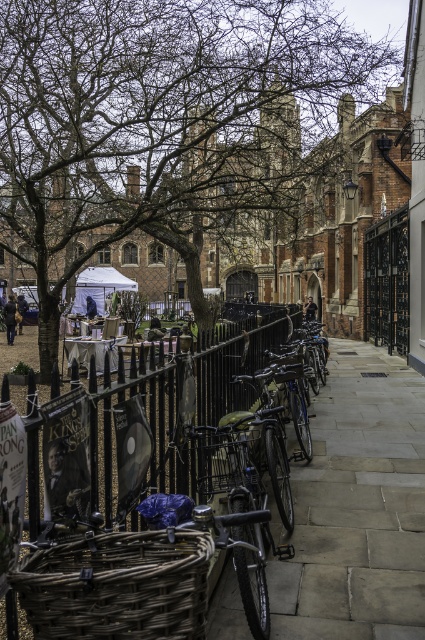
You are planning to take a photo of the gray stone pavement at center and the brown leafless tree at upper left. Which object should you focus on first if you want to capture both in a single frame without moving the camera?

You should focus on the brown leafless tree at upper left first because it is bigger than the gray stone pavement at center, so it will occupy more space in the frame and ensure both are visible.

You are organizing a picnic and have a woven brown basket at lower left and a black metal fence at center. Which item can you use to carry your picnic items?

The woven brown basket at lower left can be used to carry picnic items since it is a container, while the black metal fence at center is a structure and not designed for carrying items.

You are standing at the point closer to the viewer between the two points, point (3,100) and point (325,490). Which point are you standing at?

You are standing at point (3,100) because it is further to the viewer than point (325,490).